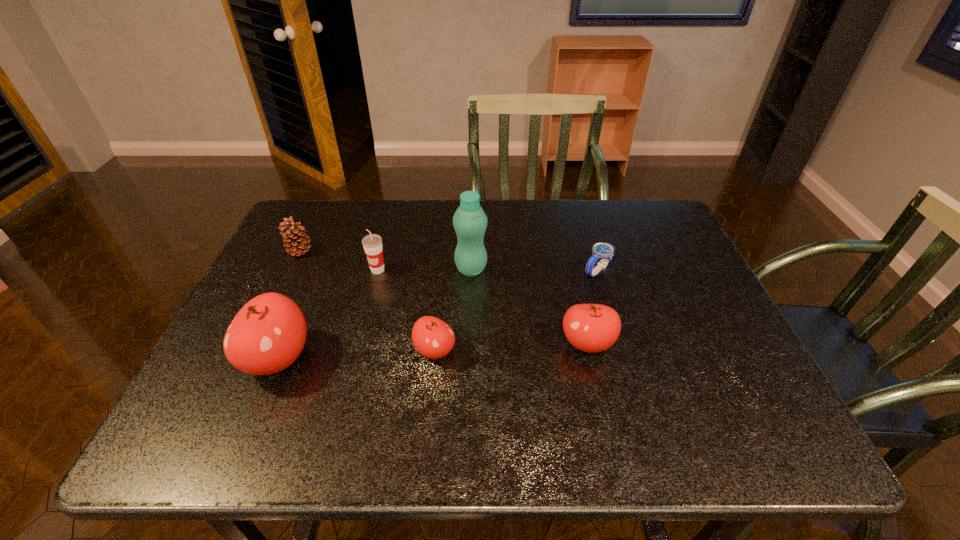
Locate an element on the screen. object situated at the far left corner is located at coordinates (295, 235).

Identify the location of object that is at the near left corner. The width and height of the screenshot is (960, 540). (267, 335).

The image size is (960, 540). Find the location of `free space at the far edge of the desktop`. free space at the far edge of the desktop is located at coordinates (501, 237).

In the image, there is a desktop. Where is `free region at the near edge`? The image size is (960, 540). free region at the near edge is located at coordinates (412, 383).

Where is `vacant space at the right edge of the desktop`? The height and width of the screenshot is (540, 960). vacant space at the right edge of the desktop is located at coordinates (663, 299).

In the image, there is a desktop. Where is `vacant area at the far left corner`? Image resolution: width=960 pixels, height=540 pixels. vacant area at the far left corner is located at coordinates (297, 214).

Find the location of a particular element. This screenshot has width=960, height=540. free space at the far right corner of the desktop is located at coordinates coord(629,224).

I want to click on free space between the watch and the second apple from right to left, so click(x=516, y=310).

The height and width of the screenshot is (540, 960). Find the location of `vacant point located between the rightmost apple and the cup`. vacant point located between the rightmost apple and the cup is located at coordinates (483, 307).

In order to click on vacant space in between the bottle and the rightmost apple in this screenshot , I will do `click(529, 306)`.